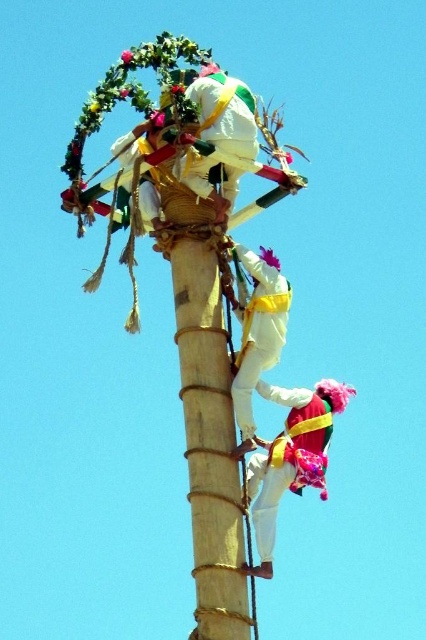
Question: Does white matte fabric at upper center have a larger size compared to white matte climbing harness at center?

Choices:
 (A) no
 (B) yes

Answer: (B)

Question: Which of the following is the farthest from the observer?

Choices:
 (A) bamboo pole at center
 (B) matte pink fabric at center
 (C) white matte climbing harness at center

Answer: (C)

Question: Which object appears farthest from the camera in this image?

Choices:
 (A) white matte climbing harness at center
 (B) matte pink fabric at center
 (C) bamboo pole at center

Answer: (A)

Question: Is white matte fabric at upper center in front of white matte climbing harness at center?

Choices:
 (A) no
 (B) yes

Answer: (A)

Question: Considering the relative positions of bamboo pole at center and white matte fabric at upper center in the image provided, where is bamboo pole at center located with respect to white matte fabric at upper center?

Choices:
 (A) above
 (B) below

Answer: (B)

Question: Considering the real-world distances, which object is closest to the white matte climbing harness at center?

Choices:
 (A) bamboo pole at center
 (B) matte pink fabric at center
 (C) white matte fabric at upper center

Answer: (A)